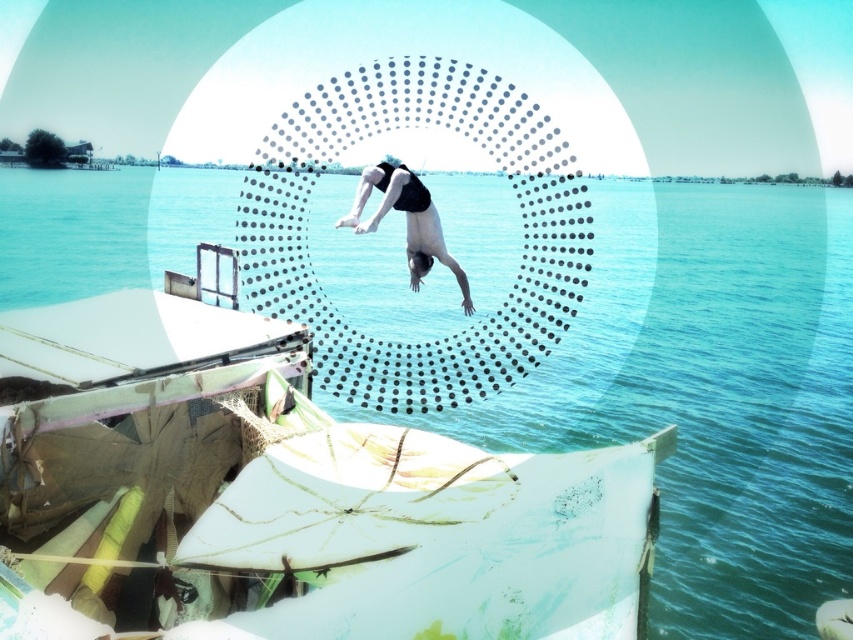
Based on the photo, you are a photographer analyzing the image. You notice the clear blue water at center and the black matte swimsuit at center. Which object appears closer to you in the image?

The clear blue water at center appears closer to you than the black matte swimsuit at center because it is further to the viewer.

You are analyzing the coordinates of the clear blue water at center in the image. What are its exact coordinates?

The clear blue water at center is located at point [747,394].